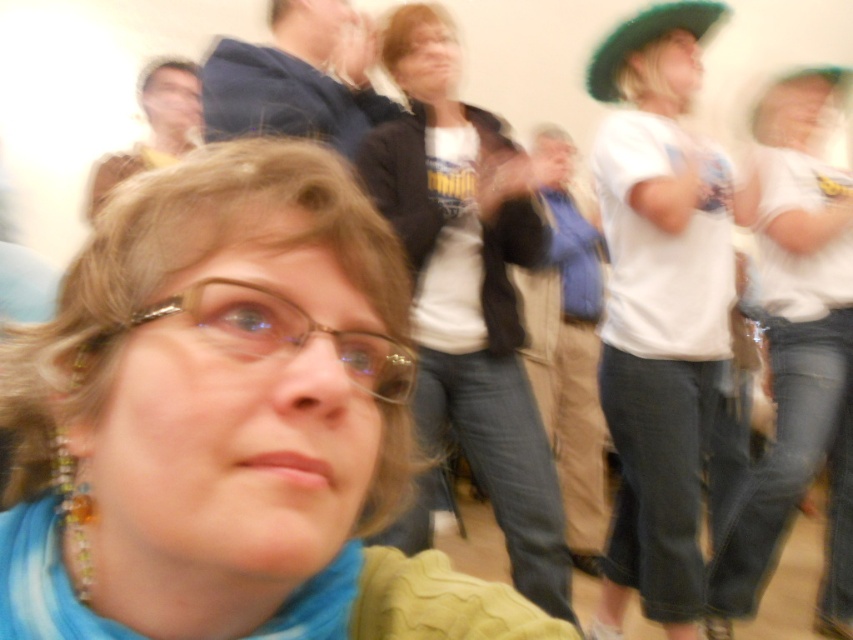
You are standing in a room and see the white cotton shirt at center and the blue fabric at upper center. Which object is closer to you?

The white cotton shirt at center is closer to you because it is further to the viewer than the blue fabric at upper center.

You are standing in the room and want to determine the distance between two points in the image. The first point is at coordinates point [527,170] and the second point is at coordinates point [323,104]. Which point is closer to you?

Point [323,104] is closer to you because it is less further to the camera than point [527,170].

You are at a social gathering and need to locate the clear plastic glasses at center and the green felt hat at upper right. Which object is positioned lower in the image?

The clear plastic glasses at center is positioned below green felt hat at upper right, so the clear plastic glasses at center is lower.